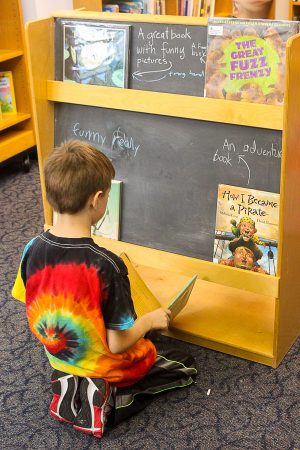
Identify the location of shoe. The height and width of the screenshot is (450, 300). (92, 399), (61, 387).